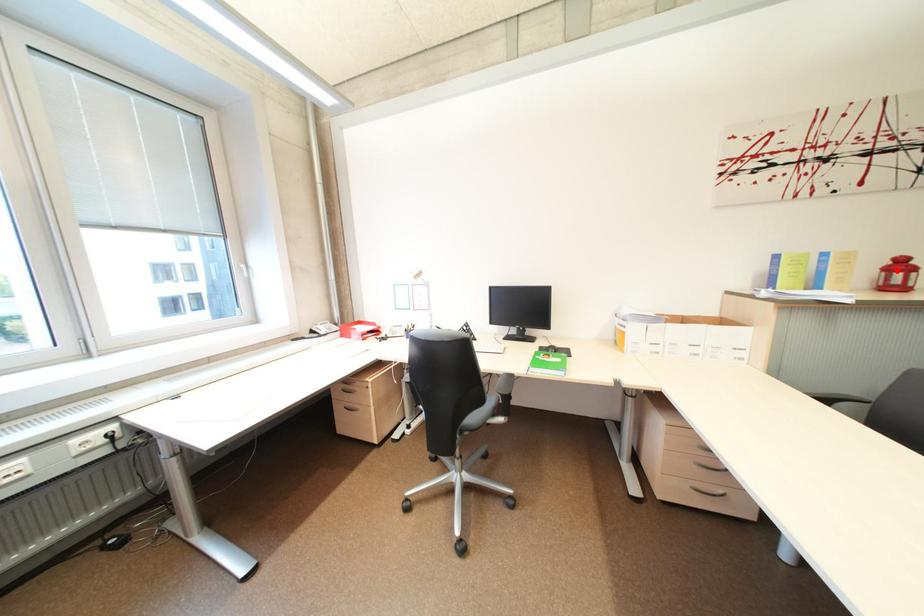
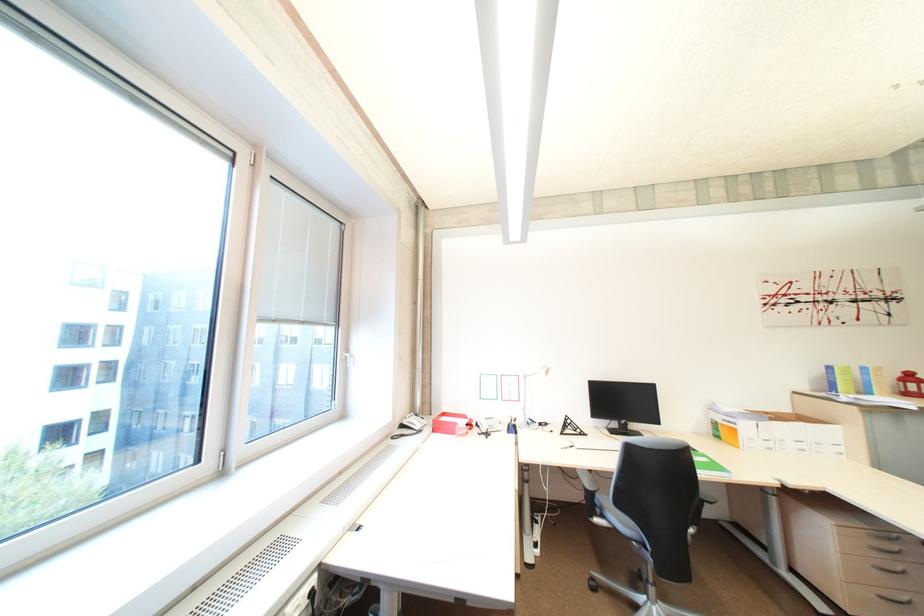
Locate, in the second image, the point that corresponds to the highlighted location in the first image.

(913, 382)